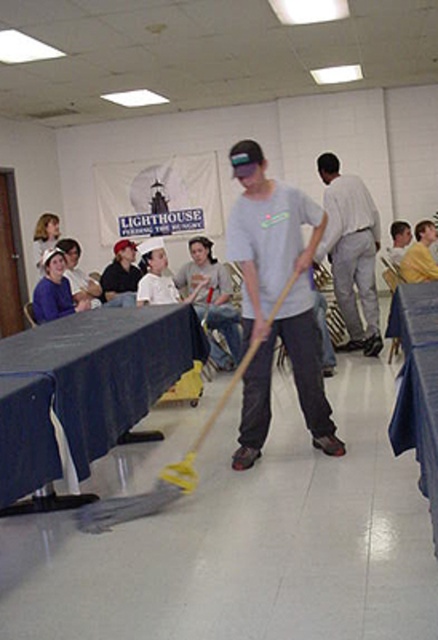
Question: Which of the following is the closest to the observer?

Choices:
 (A) (141, 330)
 (B) (120, 280)

Answer: (A)

Question: Which point is closer to the camera taking this photo?

Choices:
 (A) (x=222, y=326)
 (B) (x=314, y=328)

Answer: (B)

Question: Does blue fabric tablecloth at lower left appear under light gray pants at center?

Choices:
 (A) no
 (B) yes

Answer: (B)

Question: Which object is closer to the camera taking this photo?

Choices:
 (A) blue fabric tablecloth at lower left
 (B) dark blue jeans at center
 (C) matte gray shirt at center

Answer: (A)

Question: Does matte gray shirt at center have a smaller size compared to light gray t-shirt at center?

Choices:
 (A) yes
 (B) no

Answer: (B)

Question: Is light gray t-shirt at center to the left of dark blue jeans at center from the viewer's perspective?

Choices:
 (A) yes
 (B) no

Answer: (B)